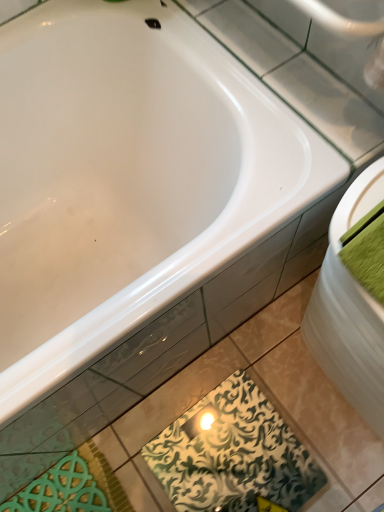
Question: Can you confirm if green patterned tile at lower center is positioned to the right of white glossy sink at right?

Choices:
 (A) yes
 (B) no

Answer: (B)

Question: Is green patterned tile at lower center positioned with its back to white glossy sink at right?

Choices:
 (A) no
 (B) yes

Answer: (A)

Question: From a real-world perspective, is green patterned tile at lower center over white glossy sink at right?

Choices:
 (A) yes
 (B) no

Answer: (B)

Question: Could you tell me if green patterned tile at lower center is facing white glossy sink at right?

Choices:
 (A) yes
 (B) no

Answer: (B)

Question: Is green patterned tile at lower center not near white glossy sink at right?

Choices:
 (A) yes
 (B) no

Answer: (B)

Question: Would you say green fabric towel at right is inside or outside white glossy sink at right?

Choices:
 (A) outside
 (B) inside

Answer: (A)

Question: Is point (370, 239) positioned closer to the camera than point (360, 353)?

Choices:
 (A) farther
 (B) closer

Answer: (B)

Question: Is green fabric towel at right wider or thinner than white glossy sink at right?

Choices:
 (A) wide
 (B) thin

Answer: (A)

Question: Considering their positions, is green fabric towel at right located in front of or behind white glossy sink at right?

Choices:
 (A) front
 (B) behind

Answer: (A)

Question: From the image's perspective, is green fabric towel at right located above or below green patterned tile at lower center?

Choices:
 (A) below
 (B) above

Answer: (B)

Question: Considering the positions of green fabric towel at right and green patterned tile at lower center in the image, is green fabric towel at right taller or shorter than green patterned tile at lower center?

Choices:
 (A) short
 (B) tall

Answer: (B)

Question: Is green fabric towel at right wider or thinner than green patterned tile at lower center?

Choices:
 (A) wide
 (B) thin

Answer: (B)

Question: Is point (380, 288) positioned closer to the camera than point (205, 435)?

Choices:
 (A) farther
 (B) closer

Answer: (B)

Question: Would you say white glossy sink at right is to the left or to the right of green patterned tile at lower center in the picture?

Choices:
 (A) left
 (B) right

Answer: (B)

Question: Considering their positions, is white glossy sink at right located in front of or behind green patterned tile at lower center?

Choices:
 (A) front
 (B) behind

Answer: (A)